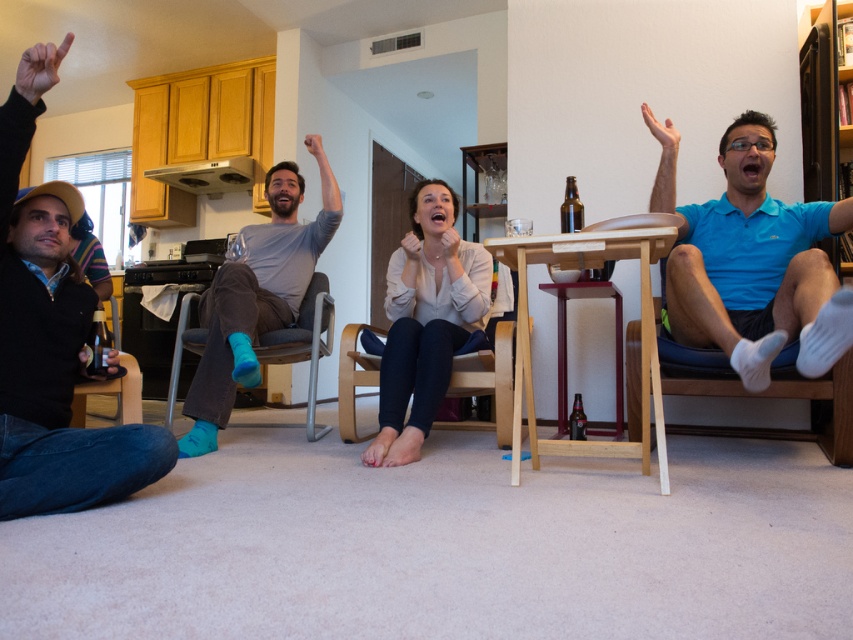
Does blue fabric chair at right have a larger size compared to wooden chair at lower left?

Incorrect, blue fabric chair at right is not larger than wooden chair at lower left.

Does blue fabric chair at right have a greater height compared to wooden chair at lower left?

Yes, blue fabric chair at right is taller than wooden chair at lower left.

Image resolution: width=853 pixels, height=640 pixels. I want to click on blue fabric chair at right, so click(833, 406).

Does wooden chair at lower left appear over matte skin hand at upper right?

Incorrect, wooden chair at lower left is not positioned above matte skin hand at upper right.

Can you confirm if wooden chair at lower left is thinner than matte skin hand at upper right?

In fact, wooden chair at lower left might be wider than matte skin hand at upper right.

Describe the element at coordinates (111, 394) in the screenshot. This screenshot has width=853, height=640. I see `wooden chair at lower left` at that location.

You are a GUI agent. You are given a task and a screenshot of the screen. Output one action in this format:
    pyautogui.click(x=<x>, y=<y>)
    Task: Click on the wooden chair at lower left
    Image resolution: width=853 pixels, height=640 pixels.
    Given the screenshot: What is the action you would take?
    pyautogui.click(x=111, y=394)

Between point (322, 323) and point (653, 125), which one is positioned behind?

The point (322, 323) is behind.

Which is in front, point (196, 346) or point (671, 161)?

Point (671, 161) is more forward.

Between point (329, 342) and point (672, 132), which one is positioned in front?

Point (672, 132) is more forward.

Where is `teal fabric chair at center`? teal fabric chair at center is located at coordinates (302, 348).